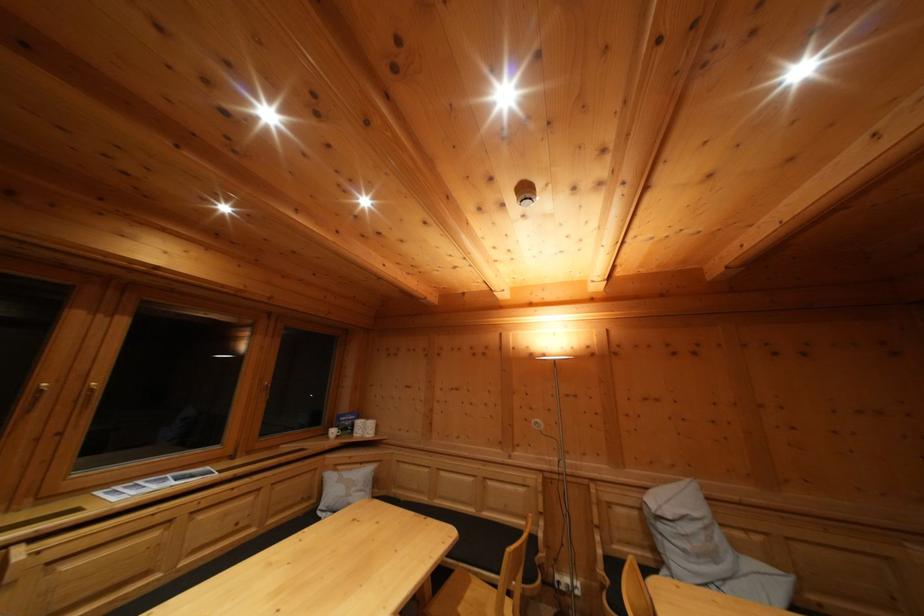
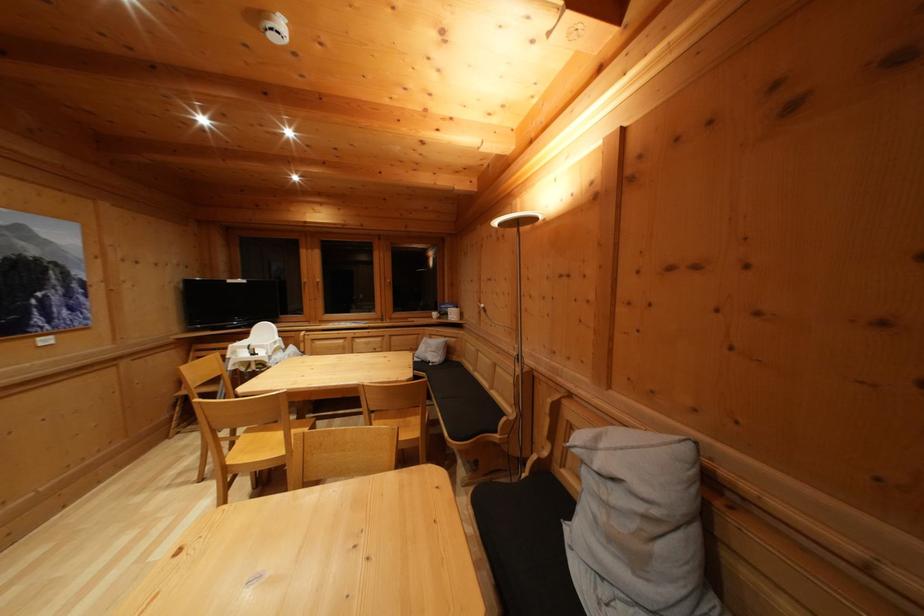
Locate, in the second image, the point that corresponds to (x=349, y=422) in the first image.

(450, 310)